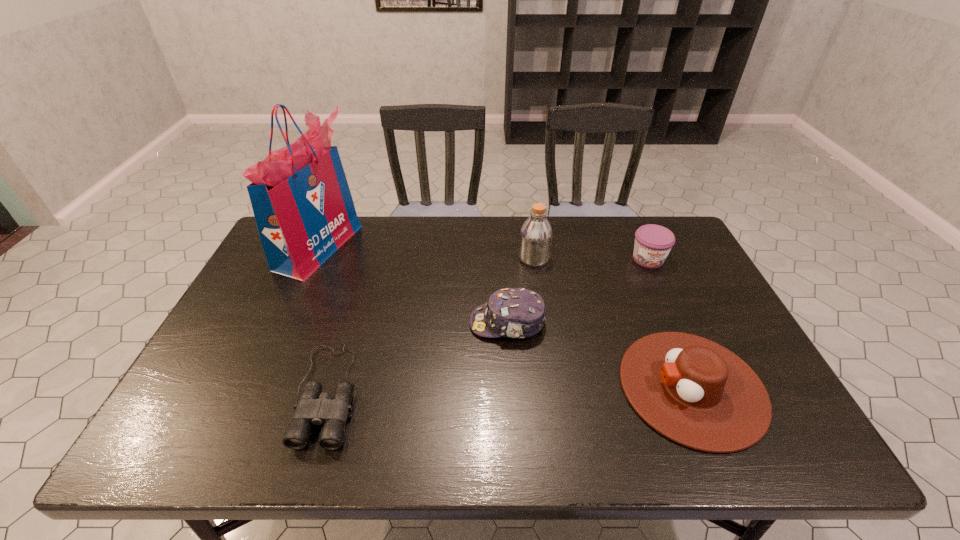
Locate an element on the screen. Image resolution: width=960 pixels, height=540 pixels. object that is at the left edge is located at coordinates (304, 211).

Image resolution: width=960 pixels, height=540 pixels. In order to click on jam that is positioned at the right edge in this screenshot , I will do `click(653, 243)`.

Where is `cowboy hat that is at the right edge`? Image resolution: width=960 pixels, height=540 pixels. cowboy hat that is at the right edge is located at coordinates (697, 393).

Find the location of `object that is at the far left corner`. object that is at the far left corner is located at coordinates (304, 211).

Where is `object that is positioned at the far right corner`? This screenshot has width=960, height=540. object that is positioned at the far right corner is located at coordinates (653, 243).

The width and height of the screenshot is (960, 540). I want to click on object that is at the near right corner, so click(697, 393).

You are a GUI agent. You are given a task and a screenshot of the screen. Output one action in this format:
    pyautogui.click(x=<x>, y=<y>)
    Task: Click on the vacant space at the far edge
    The image size is (960, 540).
    Given the screenshot: What is the action you would take?
    point(488,229)

Identify the location of free space at the near edge. The height and width of the screenshot is (540, 960). (525, 437).

Where is `free space at the left edge`? free space at the left edge is located at coordinates (253, 275).

This screenshot has height=540, width=960. Identify the location of vacant space at the near left corner of the desktop. (170, 449).